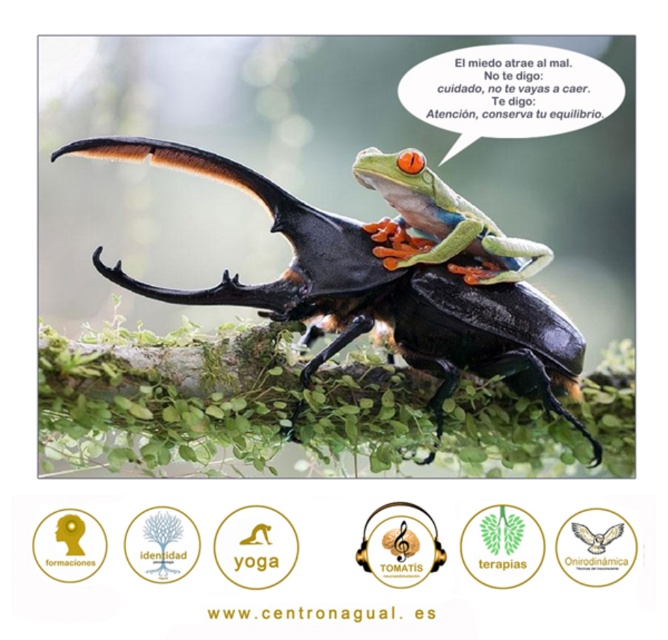
Question: Observing the image, what is the correct spatial positioning of shiny black beetle at center in reference to shiny green frog at center?

Choices:
 (A) right
 (B) left

Answer: (B)

Question: Is the position of shiny black beetle at center more distant than that of shiny green frog at center?

Choices:
 (A) no
 (B) yes

Answer: (A)

Question: Which of the following is the farthest from the observer?

Choices:
 (A) shiny black beetle at center
 (B) shiny green frog at center

Answer: (B)

Question: Does shiny black beetle at center have a larger size compared to shiny green frog at center?

Choices:
 (A) yes
 (B) no

Answer: (A)